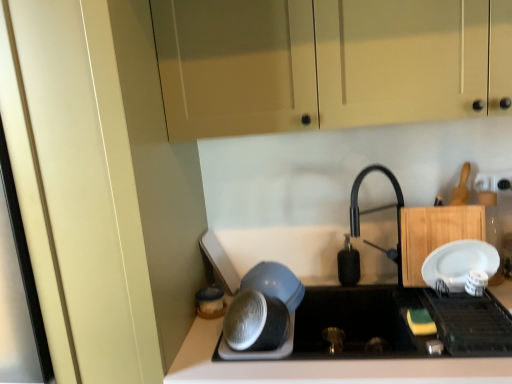
Measure the distance between white plastic electric outlet at upper right and camera.

4.58 feet.

At what (x,y) coordinates should I click in order to perform the action: click on white plastic bowls at center, which is the 2th appliance from left to right. Please return your answer as a coordinate pair (x, y). This screenshot has height=384, width=512. Looking at the image, I should click on click(x=262, y=314).

This screenshot has width=512, height=384. Describe the element at coordinates (348, 264) in the screenshot. I see `black matte soap dispenser at center, which is the 4th appliance from front to back` at that location.

The height and width of the screenshot is (384, 512). Identify the location of black matte soap dispenser at center, marked as the 1th appliance in a back-to-front arrangement. (348, 264).

In order to face wooden cutting board at right, placed as the first cabinetry when sorted from bottom to top, should I rotate leftwards or rightwards?

It's best to rotate right around 23.418 degrees.

What is the approximate width of matte plastic container at lower center, which appears as the second appliance when viewed from the back?

matte plastic container at lower center, which appears as the second appliance when viewed from the back, is 4.07 inches in width.

Image resolution: width=512 pixels, height=384 pixels. In order to click on white plastic electric outlet at upper right in this screenshot , I will do `click(493, 181)`.

Does white plastic bowls at center, acting as the third appliance starting from the right, have a smaller size compared to matte plastic container at lower center, marked as the fourth appliance in a right-to-left arrangement?

No.

Does white plastic bowls at center, the 1th appliance positioned from the front, touch matte plastic container at lower center, marked as the fourth appliance in a right-to-left arrangement?

white plastic bowls at center, the 1th appliance positioned from the front, and matte plastic container at lower center, marked as the fourth appliance in a right-to-left arrangement, are not in contact.

Which is less distant, (250, 295) or (214, 305)?

Point (250, 295) is positioned closer to the camera compared to point (214, 305).

Considering the relative sizes of white plastic bowls at center, acting as the third appliance starting from the right, and matte plastic container at lower center, marked as the fourth appliance in a right-to-left arrangement, in the image provided, is white plastic bowls at center, acting as the third appliance starting from the right, taller than matte plastic container at lower center, marked as the fourth appliance in a right-to-left arrangement,?

→ Correct, white plastic bowls at center, acting as the third appliance starting from the right, is much taller as matte plastic container at lower center, marked as the fourth appliance in a right-to-left arrangement.

Is white matte countertop at lower center far from white plastic electric outlet at upper right?

Actually, white matte countertop at lower center and white plastic electric outlet at upper right are a little close together.

Measure the distance between white matte countertop at lower center and white plastic electric outlet at upper right.

white matte countertop at lower center is 76.84 centimeters away from white plastic electric outlet at upper right.

Does white matte countertop at lower center turn towards white plastic electric outlet at upper right?

No, white matte countertop at lower center is not aimed at white plastic electric outlet at upper right.

From the image's perspective, between white matte countertop at lower center and white plastic electric outlet at upper right, who is located below?

white matte countertop at lower center appears lower in the image.

Which of these two, matte cream cabinet at upper center, the 1th cabinetry when ordered from top to bottom, or white plastic electric outlet at upper right, stands taller?

Standing taller between the two is matte cream cabinet at upper center, the 1th cabinetry when ordered from top to bottom.

Is matte cream cabinet at upper center, the second cabinetry ordered from the bottom, spatially inside white plastic electric outlet at upper right, or outside of it?

matte cream cabinet at upper center, the second cabinetry ordered from the bottom, cannot be found inside white plastic electric outlet at upper right.

Looking at their sizes, would you say matte cream cabinet at upper center, the second cabinetry ordered from the bottom, is wider or thinner than white plastic electric outlet at upper right?

Considering their sizes, matte cream cabinet at upper center, the second cabinetry ordered from the bottom, looks broader than white plastic electric outlet at upper right.

Based on the photo, does matte cream cabinet at upper center, the 1th cabinetry when ordered from top to bottom, appear on the right side of white plastic electric outlet at upper right?

No.

Is white matte countertop at lower center aimed at wooden cutting board at right, the 2th cabinetry from the top?

No, white matte countertop at lower center is not oriented towards wooden cutting board at right, the 2th cabinetry from the top.

In terms of width, does white matte countertop at lower center look wider or thinner when compared to wooden cutting board at right, placed as the first cabinetry when sorted from bottom to top?

In the image, white matte countertop at lower center appears to be wider than wooden cutting board at right, placed as the first cabinetry when sorted from bottom to top.

Is white matte countertop at lower center beside wooden cutting board at right, the 2th cabinetry from the top?

There is a gap between white matte countertop at lower center and wooden cutting board at right, the 2th cabinetry from the top.

Is matte cream cabinet at upper center, the 1th cabinetry when ordered from top to bottom, oriented away from white glossy plate at upper right, which appears as the third appliance when viewed from the back?

That's not correct — matte cream cabinet at upper center, the 1th cabinetry when ordered from top to bottom, is not looking away from white glossy plate at upper right, which appears as the third appliance when viewed from the back.

Consider the image. Measure the distance between matte cream cabinet at upper center, the 1th cabinetry when ordered from top to bottom, and white glossy plate at upper right, which is the fourth appliance in left-to-right order.

A distance of 74.24 centimeters exists between matte cream cabinet at upper center, the 1th cabinetry when ordered from top to bottom, and white glossy plate at upper right, which is the fourth appliance in left-to-right order.

Can you tell me how much matte cream cabinet at upper center, the 1th cabinetry when ordered from top to bottom, and white glossy plate at upper right, which appears as the third appliance when viewed from the back, differ in facing direction?

There is a 0.00136-degree angle between the facing directions of matte cream cabinet at upper center, the 1th cabinetry when ordered from top to bottom, and white glossy plate at upper right, which appears as the third appliance when viewed from the back.

From a real-world perspective, between matte cream cabinet at upper center, the 1th cabinetry when ordered from top to bottom, and white glossy plate at upper right, which is the fourth appliance in left-to-right order, who is vertically higher?

matte cream cabinet at upper center, the 1th cabinetry when ordered from top to bottom, is physically above.

Looking at this image, considering the sizes of objects wooden cutting board at right, placed as the first cabinetry when sorted from bottom to top, and black matte soap dispenser at center, which is the 4th appliance from front to back, in the image provided, who is bigger, wooden cutting board at right, placed as the first cabinetry when sorted from bottom to top, or black matte soap dispenser at center, which is the 4th appliance from front to back,?

wooden cutting board at right, placed as the first cabinetry when sorted from bottom to top.

How many degrees apart are the facing directions of wooden cutting board at right, placed as the first cabinetry when sorted from bottom to top, and black matte soap dispenser at center, which is the 4th appliance from front to back?

They differ by 0.195 degrees in their facing directions.

From a real-world perspective, is wooden cutting board at right, placed as the first cabinetry when sorted from bottom to top, on black matte soap dispenser at center, which is the 4th appliance from front to back?

Correct, in the physical world, wooden cutting board at right, placed as the first cabinetry when sorted from bottom to top, is higher than black matte soap dispenser at center, which is the 4th appliance from front to back.

Between matte plastic container at lower center, marked as the third appliance in a front-to-back arrangement, and black matte soap dispenser at center, which is the 4th appliance from front to back, which one appears on the right side from the viewer's perspective?

Positioned to the right is black matte soap dispenser at center, which is the 4th appliance from front to back.

At what (x,y) coordinates should I click in order to perform the action: click on the 1st appliance in front of the black matte soap dispenser at center, marked as the third appliance in a left-to-right arrangement, counting from the anchor's position. Please return your answer as a coordinate pair (x, y). Image resolution: width=512 pixels, height=384 pixels. Looking at the image, I should click on (210, 302).

Which is nearer, [217,291] or [353,283]?

The point [353,283] is closer.

Could you tell me if matte plastic container at lower center, marked as the fourth appliance in a right-to-left arrangement, is turned towards black matte soap dispenser at center, placed as the 2th appliance when sorted from right to left?

No, matte plastic container at lower center, marked as the fourth appliance in a right-to-left arrangement, is not oriented towards black matte soap dispenser at center, placed as the 2th appliance when sorted from right to left.

This screenshot has height=384, width=512. In order to click on appliance that is under the white plastic bowls at center, which ranks as the 4th appliance in back-to-front order (from a real-world perspective) in this screenshot , I will do 210,302.

At what (x,y) coordinates should I click in order to perform the action: click on electric outlet on the right of white matte countertop at lower center. Please return your answer as a coordinate pair (x, y). The width and height of the screenshot is (512, 384). Looking at the image, I should click on (493, 181).

Looking at the image, which one is located closer to white matte countertop at lower center, matte cream cabinet at upper center, the 1th cabinetry when ordered from top to bottom, or white glossy plate at upper right, which appears as the third appliance when viewed from the back?

white glossy plate at upper right, which appears as the third appliance when viewed from the back, is positioned closer to the anchor white matte countertop at lower center.

From the image, which object appears to be nearer to wooden cutting board at right, placed as the first cabinetry when sorted from bottom to top, white glossy plate at upper right, which is the fourth appliance in left-to-right order, or matte plastic container at lower center, marked as the fourth appliance in a right-to-left arrangement?

The object closer to wooden cutting board at right, placed as the first cabinetry when sorted from bottom to top, is white glossy plate at upper right, which is the fourth appliance in left-to-right order.

Which object lies nearer to the anchor point white plastic bowls at center, which ranks as the 4th appliance in back-to-front order, matte plastic container at lower center, which appears as the second appliance when viewed from the back, or white plastic electric outlet at upper right?

matte plastic container at lower center, which appears as the second appliance when viewed from the back, is closer to white plastic bowls at center, which ranks as the 4th appliance in back-to-front order.

Considering their positions, is matte plastic container at lower center, which appears as the second appliance when viewed from the back, positioned closer to white plastic bowls at center, acting as the third appliance starting from the right, than wooden cutting board at right, placed as the first cabinetry when sorted from bottom to top?

matte plastic container at lower center, which appears as the second appliance when viewed from the back, is closer to white plastic bowls at center, acting as the third appliance starting from the right.

Based on their spatial positions, is white matte countertop at lower center or matte cream cabinet at upper center, the 1th cabinetry when ordered from top to bottom, closer to white glossy plate at upper right, which is the fourth appliance in left-to-right order?

white matte countertop at lower center is closer to white glossy plate at upper right, which is the fourth appliance in left-to-right order.

Looking at this image, estimate the real-world distances between objects in this image. Which object is further from black matte soap dispenser at center, marked as the third appliance in a left-to-right arrangement, white glossy plate at upper right, marked as the first appliance in a right-to-left arrangement, or white plastic electric outlet at upper right?

Based on the image, white plastic electric outlet at upper right appears to be further to black matte soap dispenser at center, marked as the third appliance in a left-to-right arrangement.

Based on their spatial positions, is wooden cutting board at right, placed as the first cabinetry when sorted from bottom to top, or matte cream cabinet at upper center, the second cabinetry ordered from the bottom, further from white matte countertop at lower center?

The object further to white matte countertop at lower center is matte cream cabinet at upper center, the second cabinetry ordered from the bottom.

Which object lies further to the anchor point black matte soap dispenser at center, marked as the third appliance in a left-to-right arrangement, matte cream cabinet at upper center, the 1th cabinetry when ordered from top to bottom, or white plastic bowls at center, which is the 2th appliance from left to right?

matte cream cabinet at upper center, the 1th cabinetry when ordered from top to bottom, is positioned further to the anchor black matte soap dispenser at center, marked as the third appliance in a left-to-right arrangement.

Image resolution: width=512 pixels, height=384 pixels. Find the location of `cabinetry between matte cream cabinet at upper center, the second cabinetry ordered from the bottom, and black matte soap dispenser at center, which is the 4th appliance from front to back, vertically`. cabinetry between matte cream cabinet at upper center, the second cabinetry ordered from the bottom, and black matte soap dispenser at center, which is the 4th appliance from front to back, vertically is located at coordinates (435, 234).

Identify the location of appliance between white plastic bowls at center, the 1th appliance positioned from the front, and white glossy plate at upper right, the 2th appliance from the front, from left to right. (348, 264).

This screenshot has height=384, width=512. Find the location of `appliance between matte plastic container at lower center, marked as the fourth appliance in a right-to-left arrangement, and black matte soap dispenser at center, marked as the third appliance in a left-to-right arrangement, from left to right`. appliance between matte plastic container at lower center, marked as the fourth appliance in a right-to-left arrangement, and black matte soap dispenser at center, marked as the third appliance in a left-to-right arrangement, from left to right is located at coordinates (262, 314).

The width and height of the screenshot is (512, 384). I want to click on countertop between matte plastic container at lower center, marked as the first appliance in a left-to-right arrangement, and white glossy plate at upper right, which is the fourth appliance in left-to-right order, from left to right, so click(323, 366).